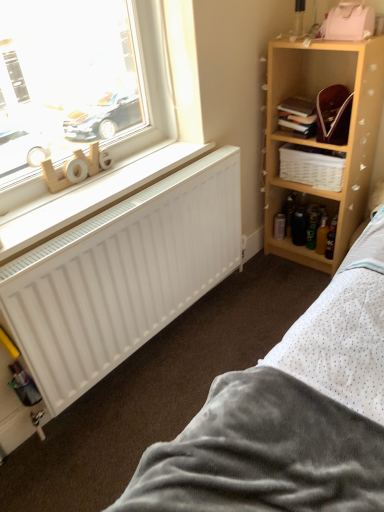
Question: Looking at the image, does hardcover book at upper right seem bigger or smaller compared to white matte radiator at lower left?

Choices:
 (A) small
 (B) big

Answer: (A)

Question: From a real-world perspective, is hardcover book at upper right physically located above or below white matte radiator at lower left?

Choices:
 (A) below
 (B) above

Answer: (B)

Question: Which object is positioned closest to the wooden shelf at upper right?

Choices:
 (A) gray soft fabric bed at lower right
 (B) white woven basket at upper right
 (C) wooden letters at window
 (D) white matte radiator at lower left
 (E) hardcover book at upper right

Answer: (B)

Question: Estimate the real-world distances between objects in this image. Which object is closer to the wooden letters at window?

Choices:
 (A) wooden letters at lower left
 (B) white matte radiator at lower left
 (C) hardcover book at upper right
 (D) wooden shelf at upper right
 (E) white woven basket at upper right

Answer: (A)